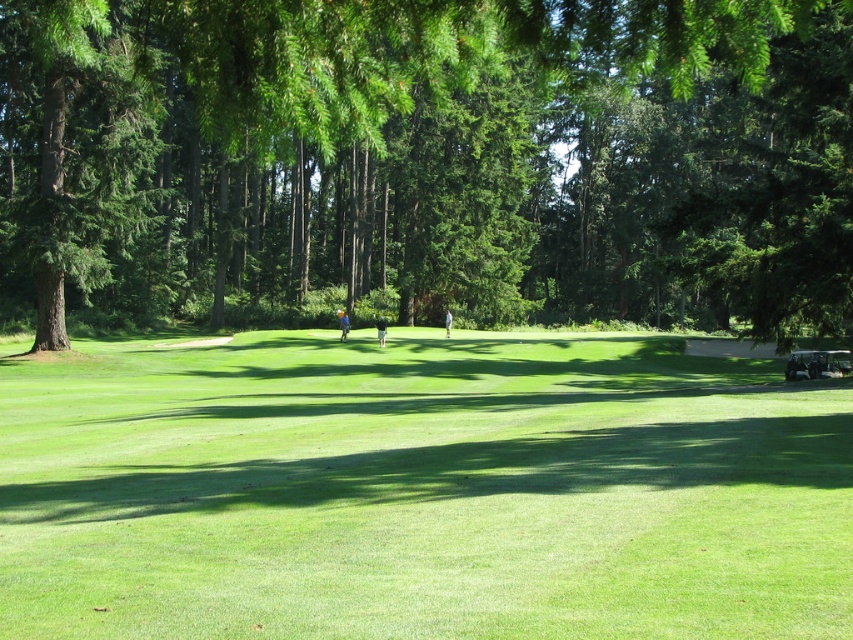
Can you confirm if green leafy tree at center is positioned above green grassy field at center?

Correct, green leafy tree at center is located above green grassy field at center.

Is green leafy tree at center to the right of green grassy field at center from the viewer's perspective?

In fact, green leafy tree at center is to the left of green grassy field at center.

Does point (463, 173) come behind point (758, 518)?

Yes, point (463, 173) is farther from viewer.

Identify the location of green leafy tree at center. (427, 160).